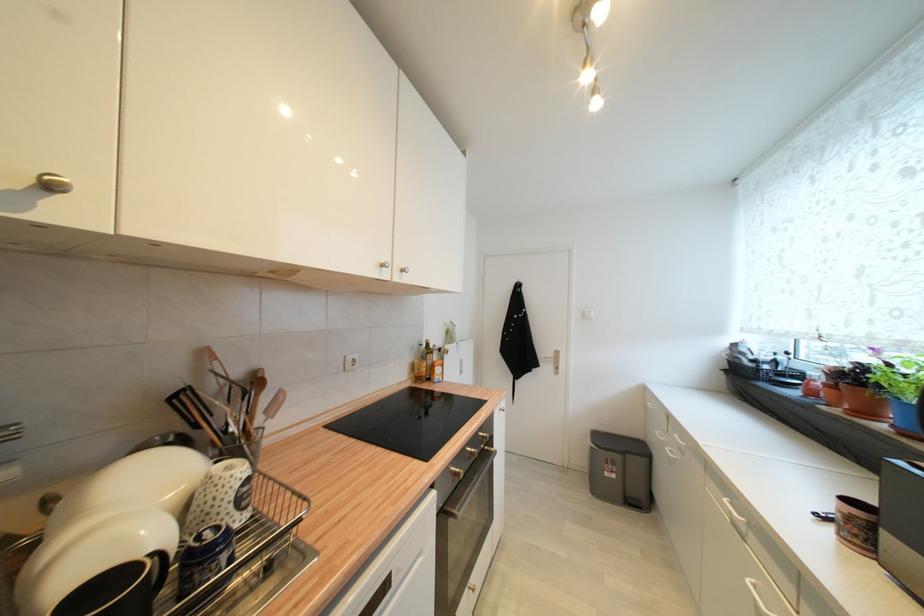
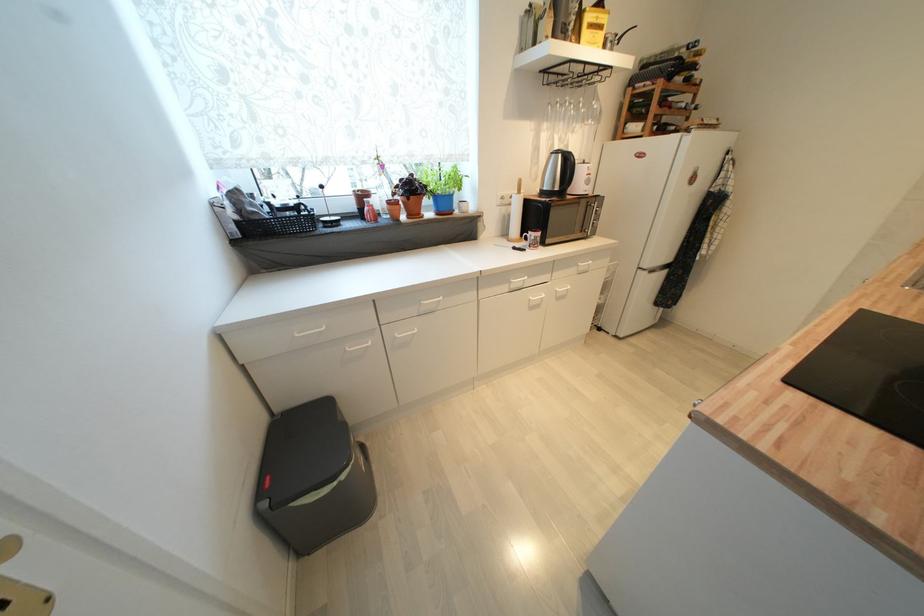
The point at (735, 363) is marked in the first image. Where is the corresponding point in the second image?

(242, 225)